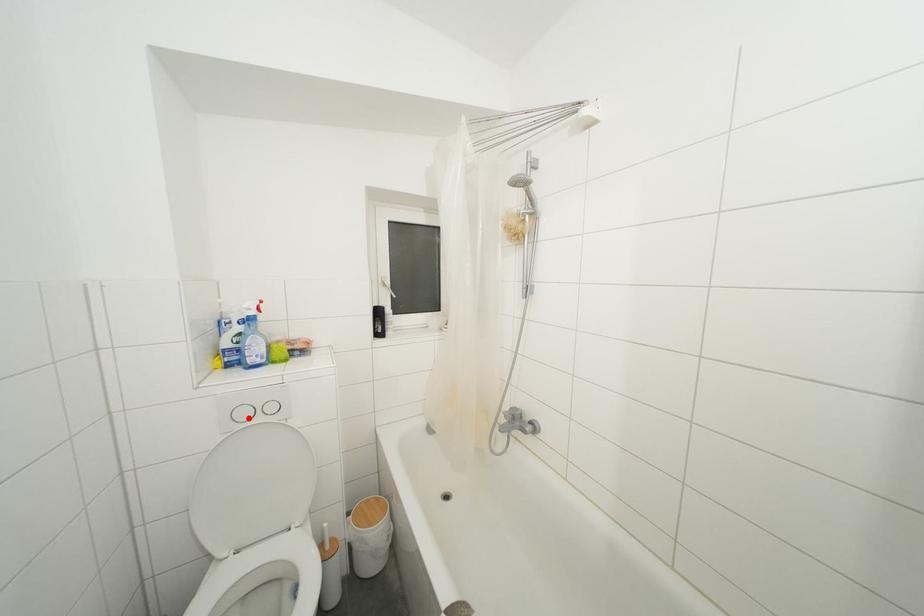
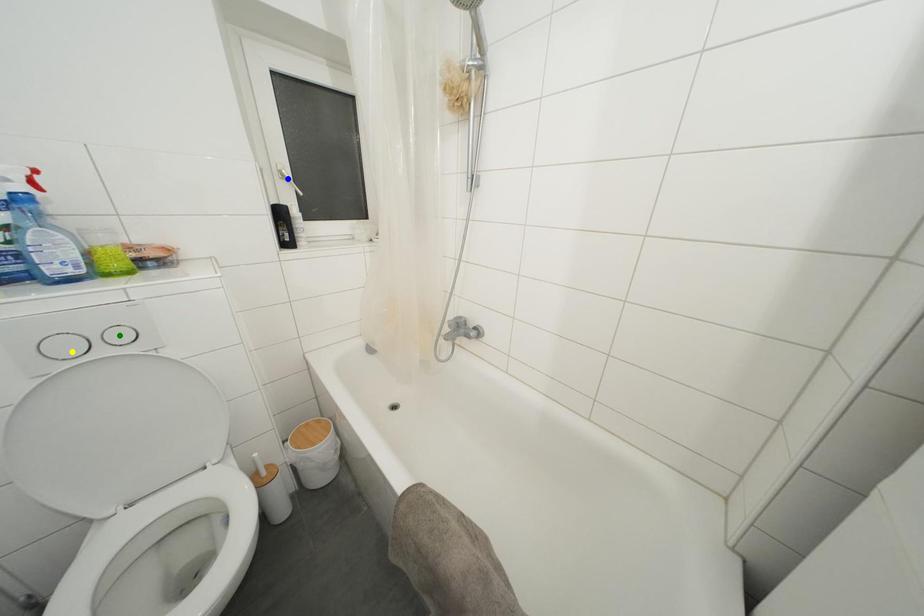
Question: I am providing you with two images of the same scene from different viewpoints. A red point is marked on the first image. You are given multiple points on the second image. Which point in image 2 represents the same 3d spot as the red point in image 1?

Choices:
 (A) green point
 (B) yellow point
 (C) blue point

Answer: (B)